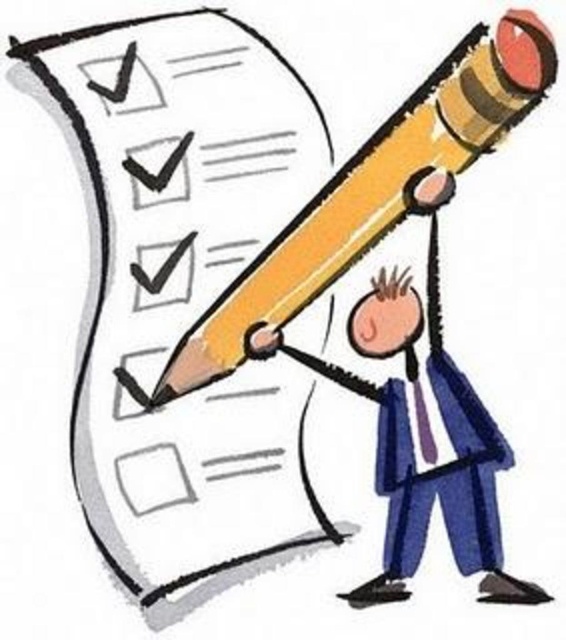
Question: Based on their relative distances, which object is nearer to the yellow matte pencil at upper center?

Choices:
 (A) blue fabric business suit at lower right
 (B) pink matte head at center

Answer: (B)

Question: Does yellow matte pencil at upper center lie behind pink matte head at center?

Choices:
 (A) no
 (B) yes

Answer: (A)

Question: Which point is farther to the camera?

Choices:
 (A) (374, 296)
 (B) (228, 333)
 (C) (460, 442)

Answer: (A)

Question: Is yellow matte pencil at upper center further to the viewer compared to pink matte head at center?

Choices:
 (A) yes
 (B) no

Answer: (B)

Question: Does yellow matte pencil at upper center have a lesser width compared to blue fabric business suit at lower right?

Choices:
 (A) no
 (B) yes

Answer: (A)

Question: Which of the following is the closest to the observer?

Choices:
 (A) blue fabric business suit at lower right
 (B) pink matte head at center

Answer: (A)